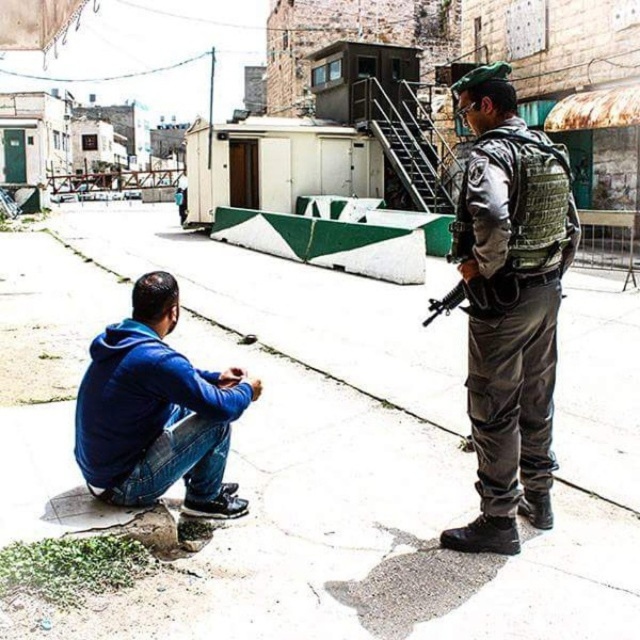
You are a delivery drone operator. Your drone is currently hovering at point (324, 448). You need to land it on a surface that can support its weight. Is the surface at this point suitable for landing?

The surface at point (324, 448) is smooth concrete pavement at center, which is a solid and stable surface capable of supporting the drone. Therefore, it is suitable for landing.

You are a delivery drone operator. Your drone is currently hovering at the point with coordinates point (x=324, y=448). You need to land it on a surface that can support its weight. Based on the scene description, what surface is the drone currently above?

The point (x=324, y=448) corresponds to smooth concrete pavement at center, so the drone is above the smooth concrete pavement at center.

You are a photographer positioned at the edge of the paved area. You want to capture a photo that includes both the smooth concrete pavement at center and the camouflage fabric uniform at center. Which object will appear larger in the photo?

The smooth concrete pavement at center will appear larger in the photo because it is closer to the viewer than the camouflage fabric uniform at center.